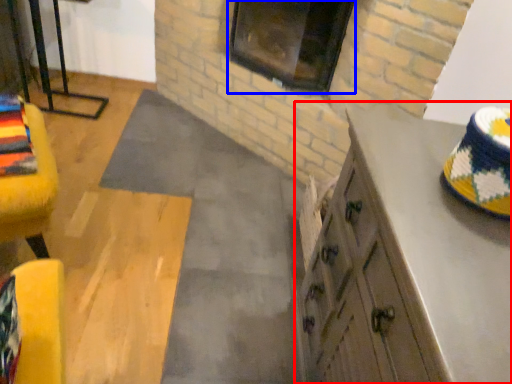
Question: Which point is closer to the camera, cabinetry (highlighted by a red box) or window (highlighted by a blue box)?

Choices:
 (A) cabinetry
 (B) window

Answer: (A)